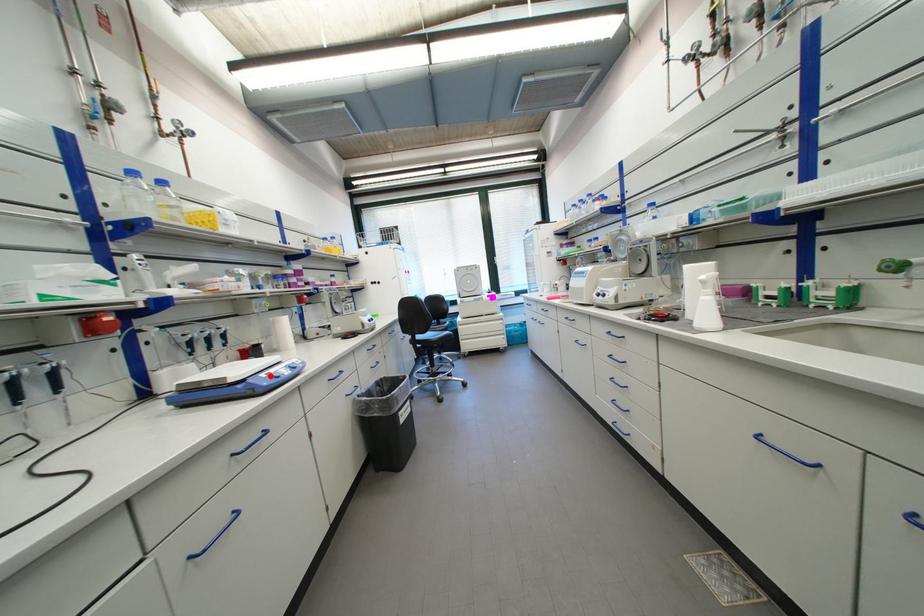
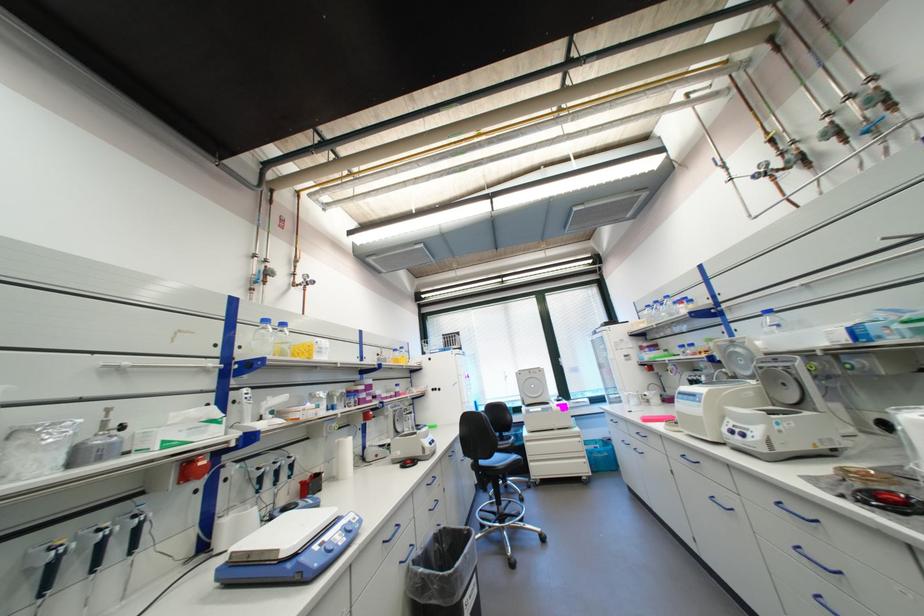
The point at the highlighted location is marked in the first image. Where is the corresponding point in the second image?

(323, 548)